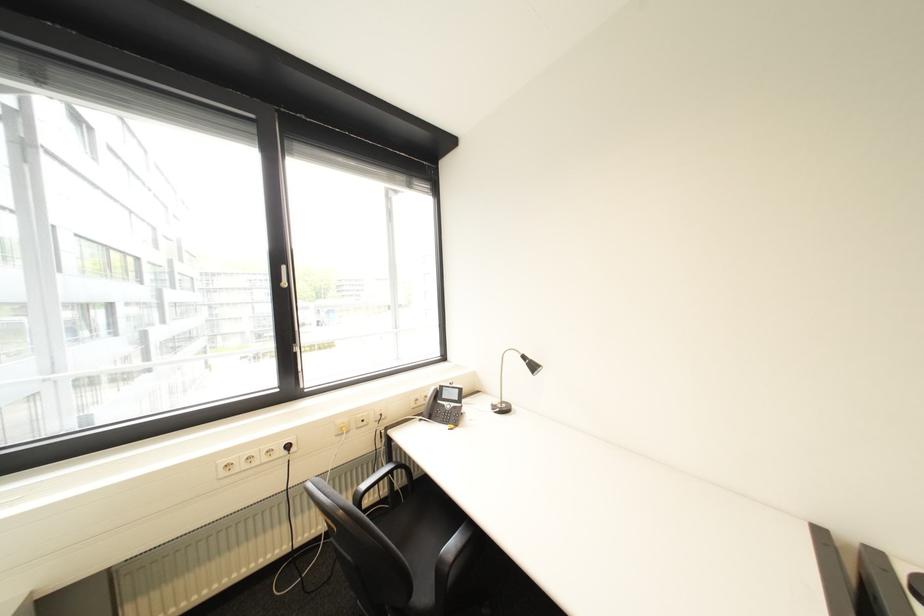
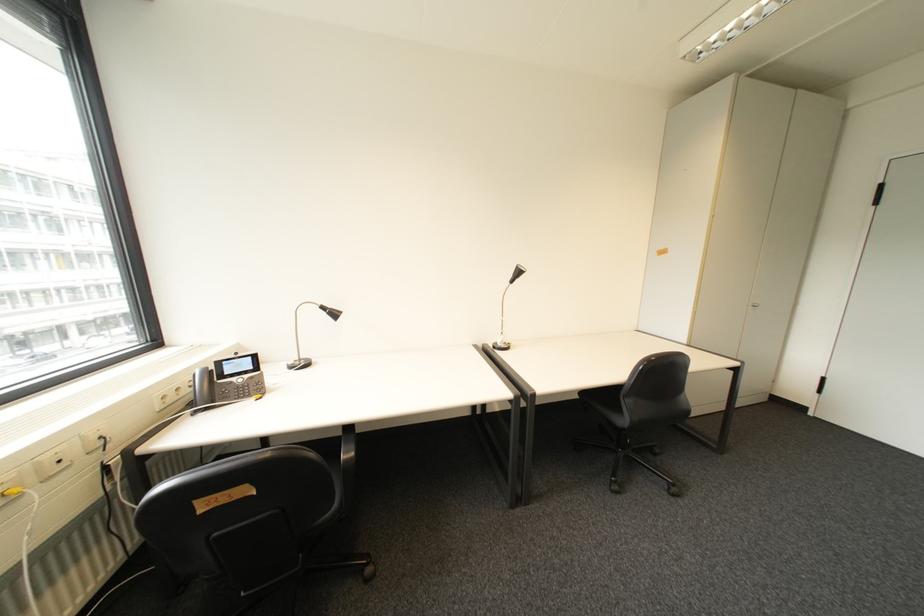
Question: Based on the continuous images, in which direction is the camera rotating? Reply with the corresponding letter.

Choices:
 (A) Left
 (B) Right
 (C) Up
 (D) Down

Answer: (B)